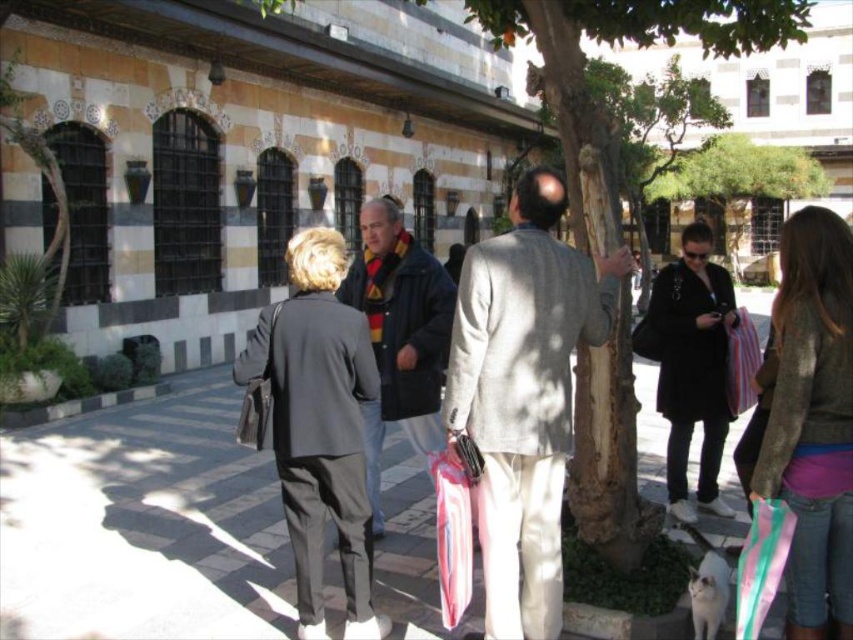
You are a photographer standing in the courtyard and see two people wearing the dark blue jacket at center and the black matte coat at center. Which person is wearing the shorter coat?

The dark blue jacket at center is shorter than the black matte coat at center, so the person wearing the dark blue jacket at center has the shorter coat.

You are a photographer standing in the courtyard and see a person wearing a dark gray suit at center holding a striped cotton shopping bag at right. Can you tell me which item is larger?

The dark gray suit at center is bigger than the striped cotton shopping bag at right.